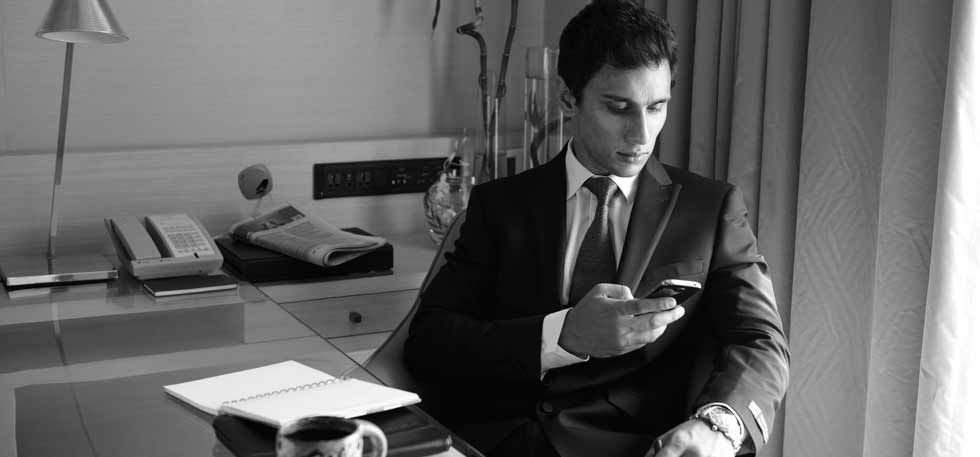
Find the location of `desk`. desk is located at coordinates (99, 388).